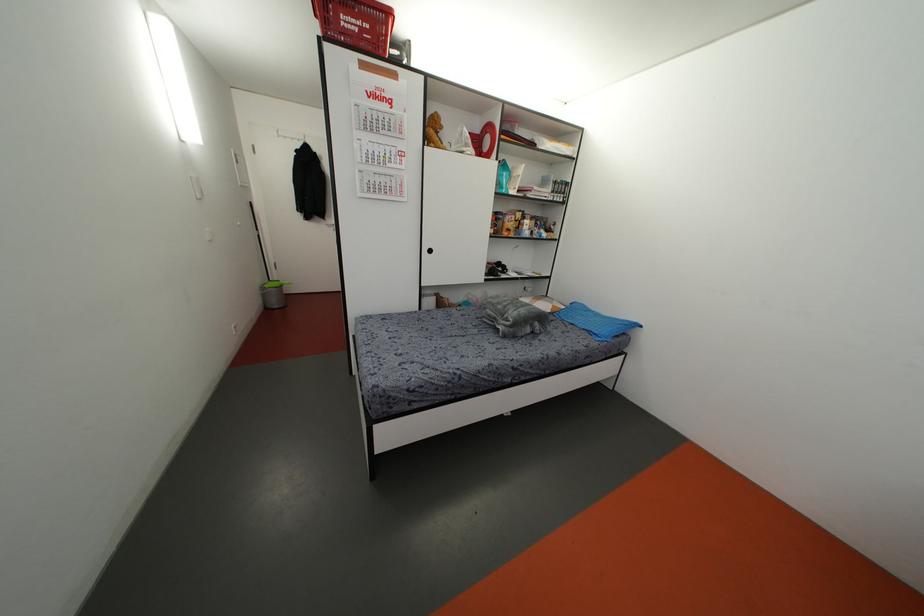
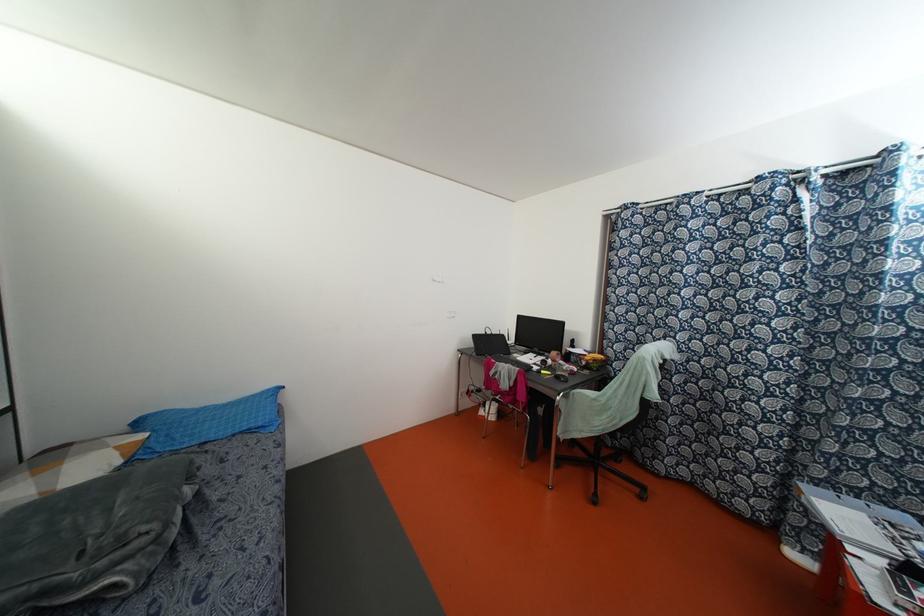
Question: I am providing you with two images of the same scene from different viewpoints. Which of the following objects are not visible in image2?

Choices:
 (A) yellow banana
 (B) black laptop
 (C) blue pillow
 (D) none of these

Answer: (D)